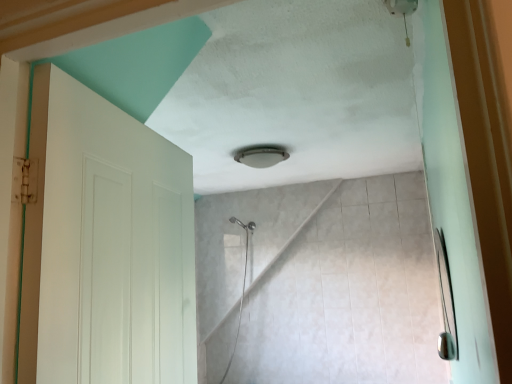
I want to click on white matte door at left, so click(106, 245).

What do you see at coordinates (106, 245) in the screenshot? The height and width of the screenshot is (384, 512). I see `white matte door at left` at bounding box center [106, 245].

At what (x,y) coordinates should I click in order to perform the action: click on white matte door at left. Please return your answer as a coordinate pair (x, y). This screenshot has height=384, width=512. Looking at the image, I should click on (106, 245).